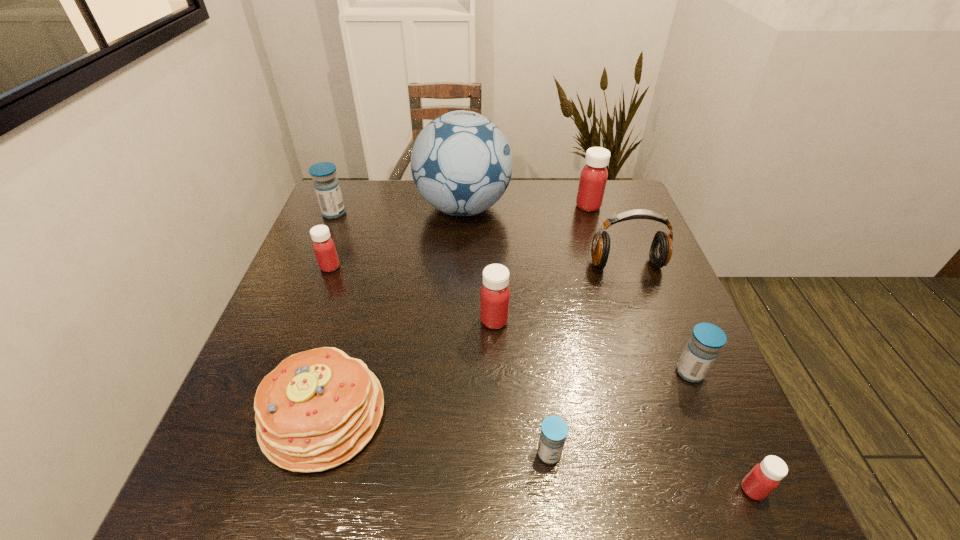
Locate an element on the screen. The height and width of the screenshot is (540, 960). the fifth nearest medicine is located at coordinates (323, 245).

Identify the location of the second nearest blue medicine. The height and width of the screenshot is (540, 960). (707, 339).

Locate an element on the screen. the fifth farthest medicine is located at coordinates (707, 339).

The height and width of the screenshot is (540, 960). Identify the location of pancake. (317, 409).

I want to click on the sixth farthest medicine, so click(554, 430).

At what (x,y) coordinates should I click in order to perform the action: click on the smallest blue medicine. Please return your answer as a coordinate pair (x, y). The width and height of the screenshot is (960, 540). Looking at the image, I should click on (554, 430).

This screenshot has width=960, height=540. I want to click on the smallest red medicine, so pyautogui.click(x=766, y=476).

Identify the location of the nearest red medicine. The image size is (960, 540). (766, 476).

This screenshot has height=540, width=960. Find the location of `free region located 0.330m on the side with brand of the blue soccer ball`. free region located 0.330m on the side with brand of the blue soccer ball is located at coordinates (619, 208).

Where is `free region located 0.200m on the front of the third red medicine from left to right`? The width and height of the screenshot is (960, 540). free region located 0.200m on the front of the third red medicine from left to right is located at coordinates (604, 257).